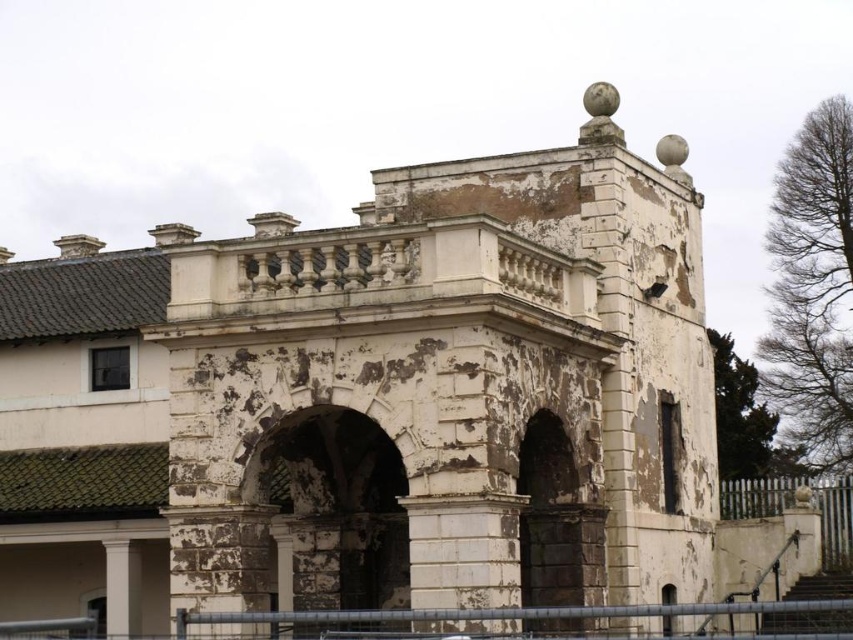
Which of these two, metallic gray fence at lower center or white wooden fence at lower right, stands shorter?

With less height is white wooden fence at lower right.

Which is above, metallic gray fence at lower center or white wooden fence at lower right?

metallic gray fence at lower center

Is point (738, 602) farther from camera compared to point (834, 515)?

No, it is not.

Identify the location of metallic gray fence at lower center. The width and height of the screenshot is (853, 640). (500, 612).